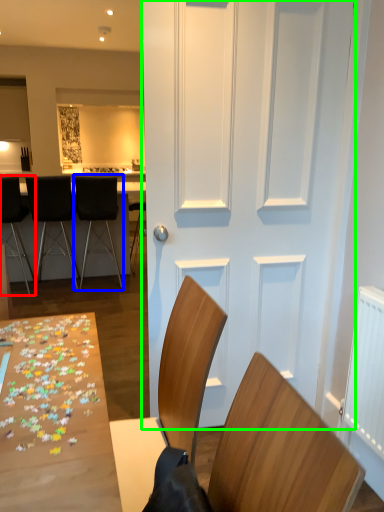
Question: Which is farther away from chair (highlighted by a red box)? chair (highlighted by a blue box) or door (highlighted by a green box)?

Choices:
 (A) chair
 (B) door

Answer: (B)